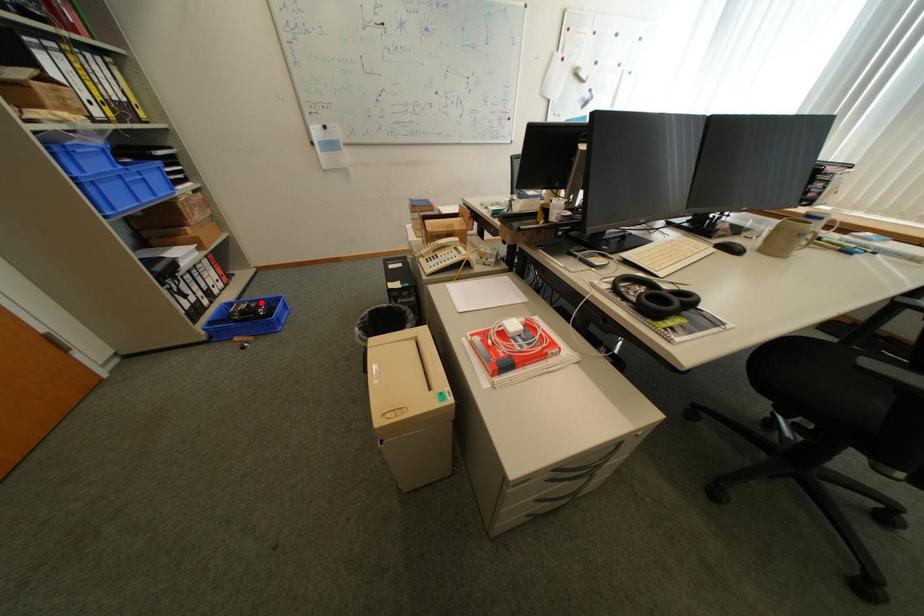
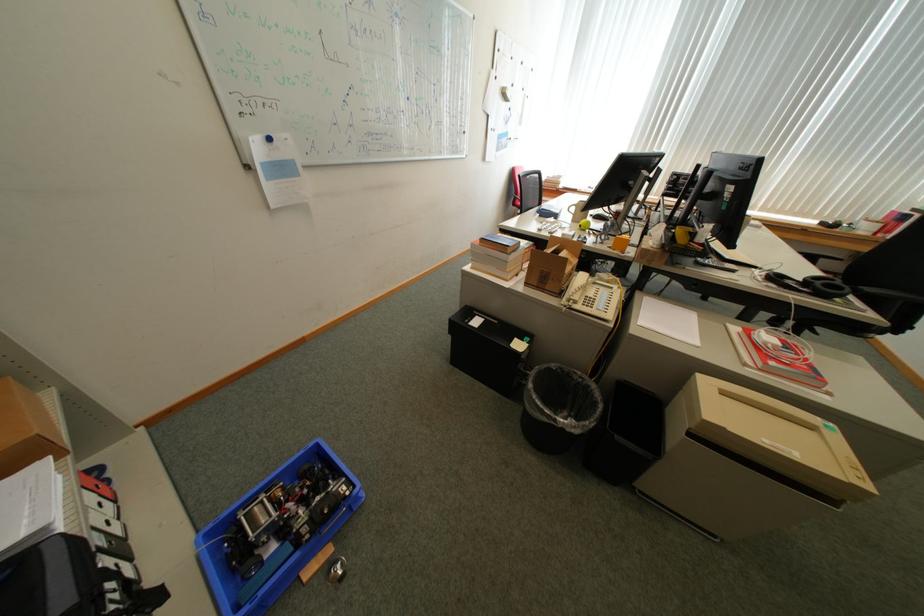
Locate, in the second image, the point that corresponds to the highlighted location in the first image.

(276, 490)